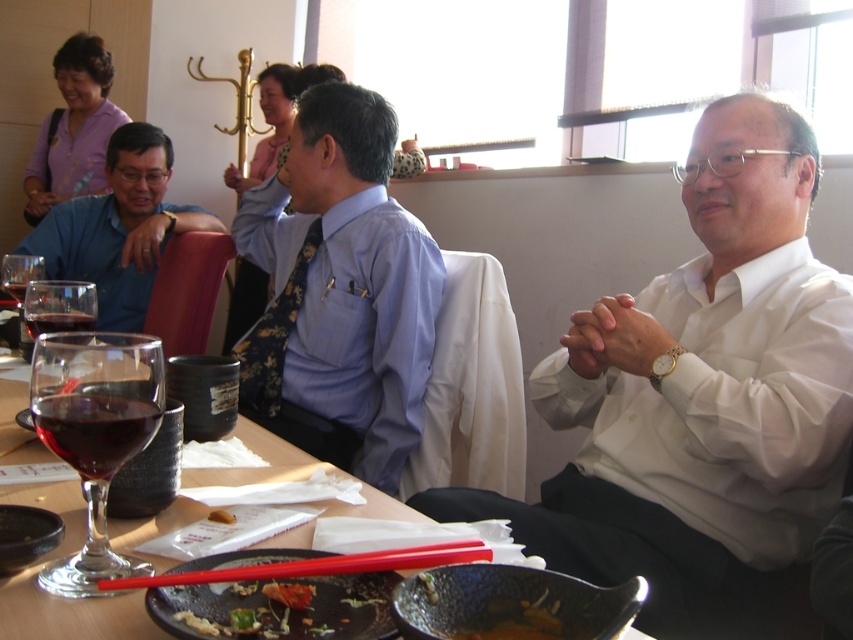
Question: Observing the image, what is the correct spatial positioning of matte blue shirt at left in reference to transparent glass wine at table left?

Choices:
 (A) left
 (B) right

Answer: (A)

Question: Where is floral silk tie at center located in relation to shiny red sauce at center in the image?

Choices:
 (A) left
 (B) right

Answer: (A)

Question: Which of the following is the farthest from the observer?

Choices:
 (A) (144, 164)
 (B) (349, 564)
 (C) (74, 333)

Answer: (A)

Question: Among these points, which one is farthest from the camera?

Choices:
 (A) (143, 253)
 (B) (71, 435)
 (C) (215, 515)

Answer: (A)

Question: Is light blue shirt at center further to the viewer compared to ruby glass at center?

Choices:
 (A) yes
 (B) no

Answer: (A)

Question: Which point is farther from the camera taking this photo?

Choices:
 (A) click(x=663, y=588)
 (B) click(x=57, y=324)
 (C) click(x=236, y=630)

Answer: (B)